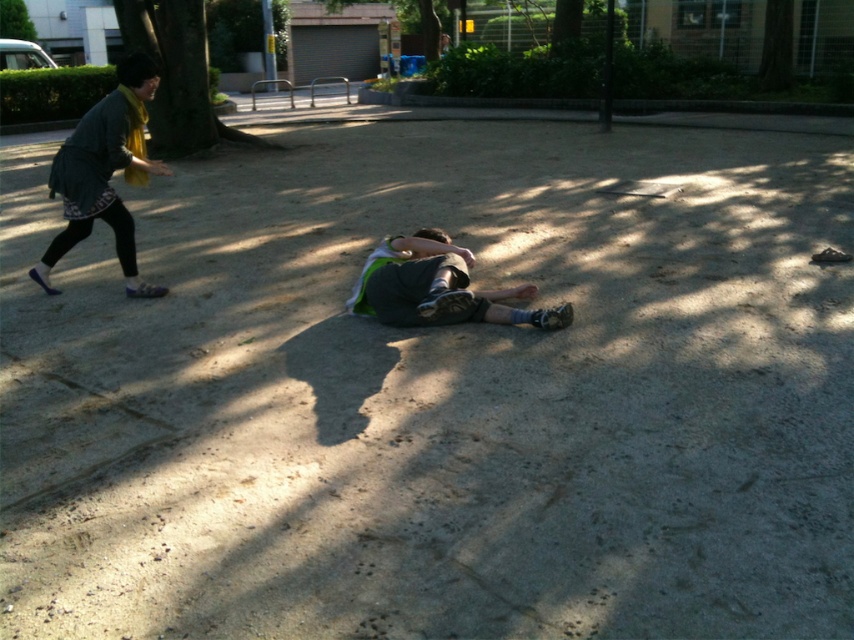
In the scene shown: You are standing at the point marked by the coordinates [104,172] in the park. Looking around, you see a person lying on their back and another person running to your left. Which direction should you walk to reach the person lying on their back?

The green fabric shirt at center is located at point [104,172]. Since the person lying on their back is at the center, you should walk towards the center of the image to reach them.

You are a photographer trying to capture the person lying on the ground. You notice the green fabric shirt at center and the green fabric shorts at center. Which item is positioned higher in the image?

The green fabric shirt at center is located above the green fabric shorts at center, so it is positioned higher in the image.